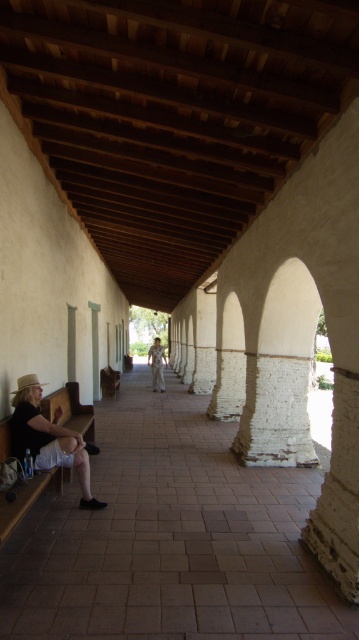
Who is shorter, matte black shirt at lower left or light brown wood statue at center?

With less height is matte black shirt at lower left.

You are a GUI agent. You are given a task and a screenshot of the screen. Output one action in this format:
    pyautogui.click(x=<x>, y=<y>)
    Task: Click on the matte black shirt at lower left
    The width and height of the screenshot is (359, 640).
    Given the screenshot: What is the action you would take?
    [x=48, y=438]

Which is behind, point (71, 429) or point (156, 369)?

The point (156, 369) is more distant.

Locate an element on the screen. matte black shirt at lower left is located at coordinates (48, 438).